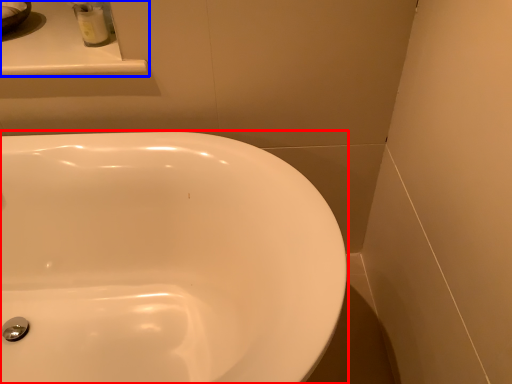
Question: Among these objects, which one is nearest to the camera, sink (highlighted by a red box) or counter top (highlighted by a blue box)?

Choices:
 (A) sink
 (B) counter top

Answer: (A)